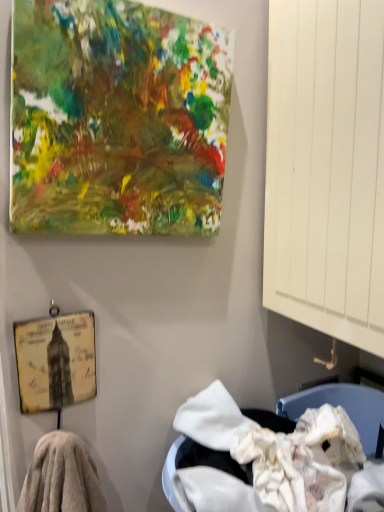
Question: Is yellowed paper picture frame at lower left further to camera compared to abstract multicolored canvas at upper left?

Choices:
 (A) no
 (B) yes

Answer: (B)

Question: Does yellowed paper picture frame at lower left have a greater width compared to abstract multicolored canvas at upper left?

Choices:
 (A) no
 (B) yes

Answer: (A)

Question: Does yellowed paper picture frame at lower left have a lesser height compared to abstract multicolored canvas at upper left?

Choices:
 (A) yes
 (B) no

Answer: (A)

Question: Is yellowed paper picture frame at lower left bigger than abstract multicolored canvas at upper left?

Choices:
 (A) yes
 (B) no

Answer: (B)

Question: Can you confirm if yellowed paper picture frame at lower left is positioned to the left of abstract multicolored canvas at upper left?

Choices:
 (A) yes
 (B) no

Answer: (A)

Question: Considering the positions of yellowed paper picture frame at lower left and fuzzy towel at lower left in the image, is yellowed paper picture frame at lower left bigger or smaller than fuzzy towel at lower left?

Choices:
 (A) small
 (B) big

Answer: (A)

Question: From a real-world perspective, is yellowed paper picture frame at lower left above or below fuzzy towel at lower left?

Choices:
 (A) below
 (B) above

Answer: (B)

Question: Is point (84, 377) closer or farther from the camera than point (56, 506)?

Choices:
 (A) closer
 (B) farther

Answer: (B)

Question: In terms of height, does yellowed paper picture frame at lower left look taller or shorter compared to fuzzy towel at lower left?

Choices:
 (A) short
 (B) tall

Answer: (A)

Question: From the image's perspective, relative to yellowed paper picture frame at lower left, is abstract multicolored canvas at upper left above or below?

Choices:
 (A) above
 (B) below

Answer: (A)

Question: Is point (205, 208) positioned closer to the camera than point (34, 359)?

Choices:
 (A) farther
 (B) closer

Answer: (A)

Question: In the image, is abstract multicolored canvas at upper left positioned in front of or behind yellowed paper picture frame at lower left?

Choices:
 (A) behind
 (B) front

Answer: (B)

Question: From a real-world perspective, is abstract multicolored canvas at upper left physically located above or below yellowed paper picture frame at lower left?

Choices:
 (A) below
 (B) above

Answer: (B)

Question: Relative to abstract multicolored canvas at upper left, is fuzzy towel at lower left in front or behind?

Choices:
 (A) behind
 (B) front

Answer: (A)

Question: Is fuzzy towel at lower left taller or shorter than abstract multicolored canvas at upper left?

Choices:
 (A) short
 (B) tall

Answer: (A)